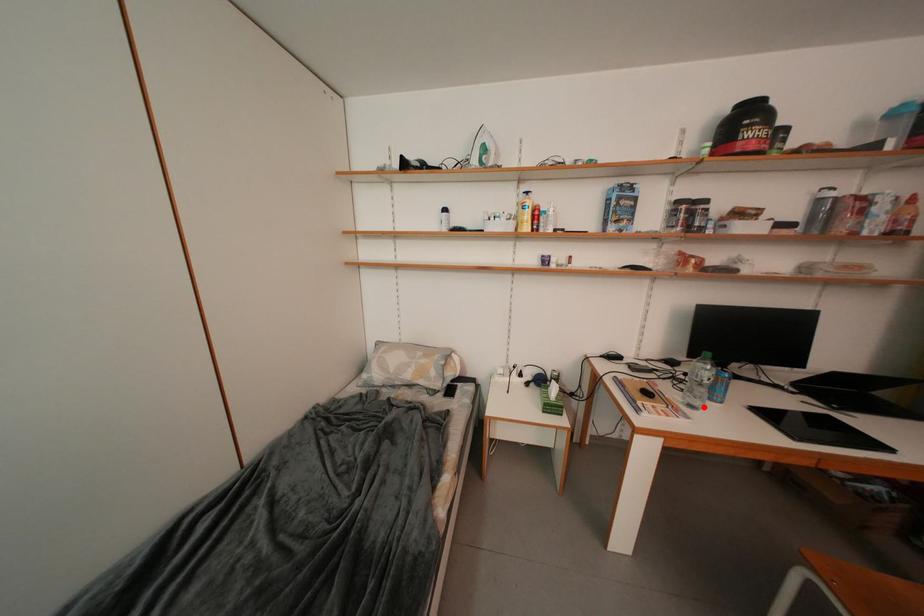
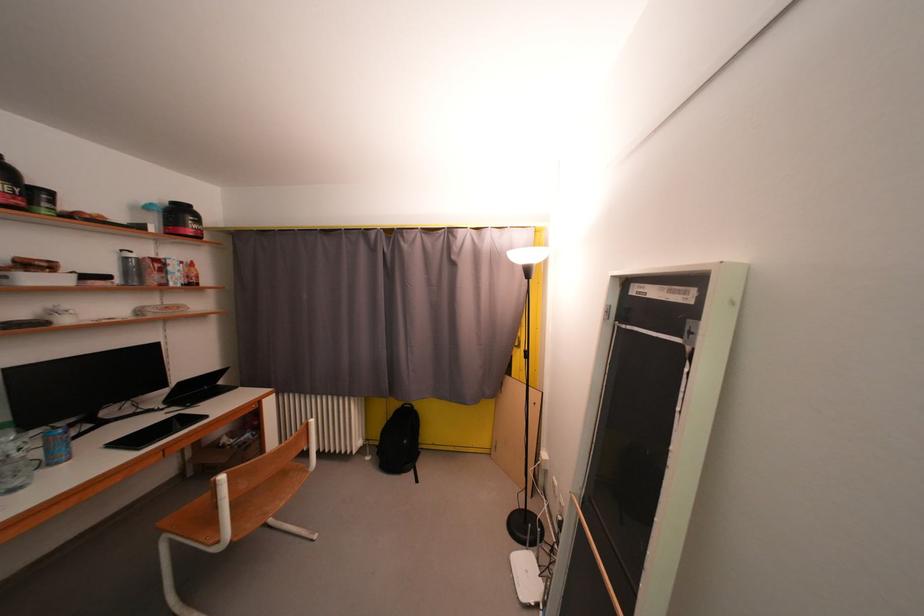
Question: I am providing you with two images of the same scene from different viewpoints. Image1 has a red point marked. In image2, the corresponding 3D location appears at what relative position? Reply with the corresponding letter.

Choices:
 (A) Closer
 (B) Farther

Answer: (A)